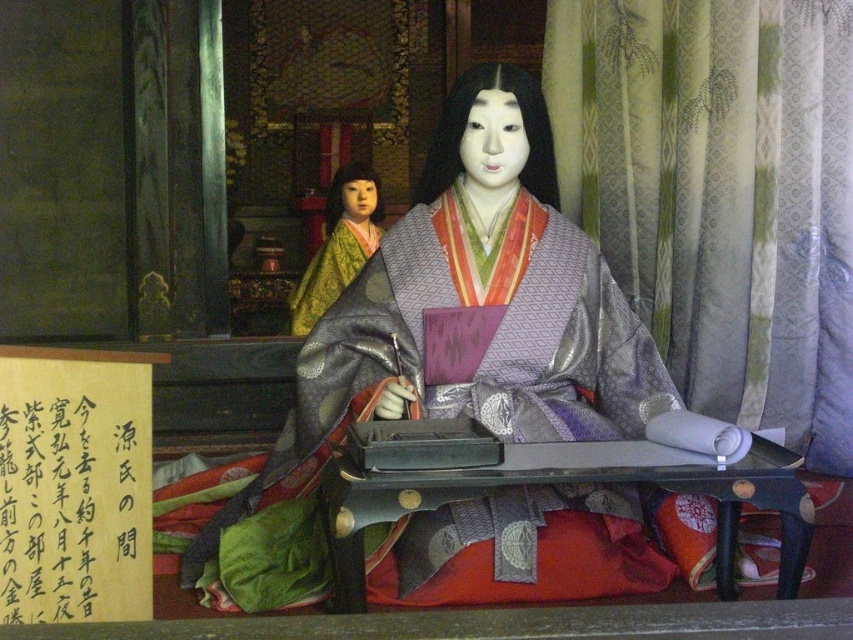
Question: Is the position of silky green curtain at right less distant than that of silky purple kimono at center?

Choices:
 (A) no
 (B) yes

Answer: (A)

Question: Does silky purple kimono at center have a greater width compared to silky green kimono at left?

Choices:
 (A) yes
 (B) no

Answer: (A)

Question: Which object is positioned farthest from the silky green curtain at right?

Choices:
 (A) silky green kimono at left
 (B) silky purple kimono at center

Answer: (A)

Question: Which point is farther to the camera?

Choices:
 (A) silky green kimono at left
 (B) silky purple kimono at center

Answer: (A)

Question: Which of the following is the closest to the observer?

Choices:
 (A) (674, 307)
 (B) (312, 285)

Answer: (A)

Question: Can you confirm if silky purple kimono at center is positioned below silky green kimono at left?

Choices:
 (A) yes
 (B) no

Answer: (A)